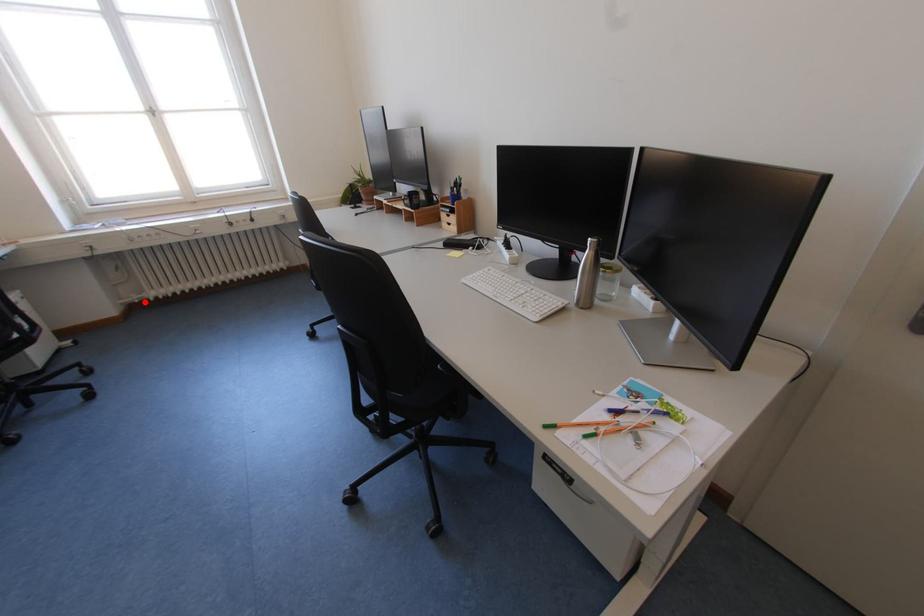
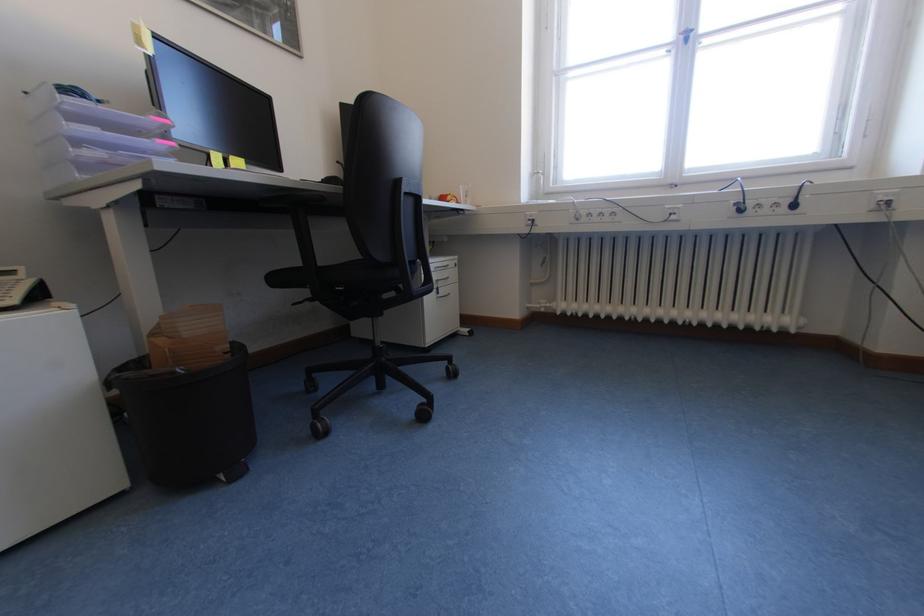
Locate, in the second image, the point that corresponds to the highlighted location in the first image.

(551, 310)